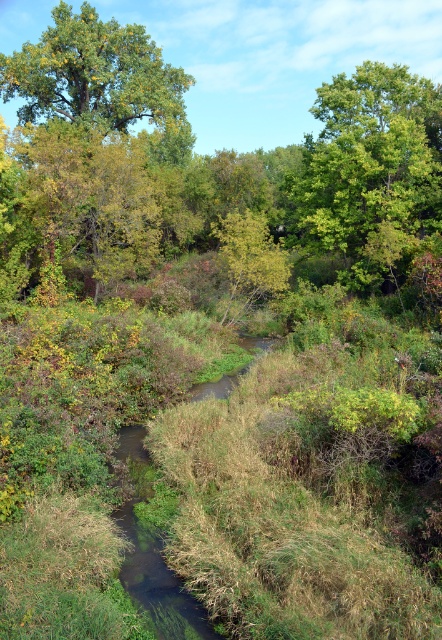
You are planning to plant a new tree in this area and need to ensure it will have enough space between the existing trees. The new tree requires a minimum of 5 meters of space between itself and any other tree. Given the current spacing between the green leafy tree at upper right and the green leafy tree at center, can you plant the new tree between them without violating the spacing requirement?

The distance between the green leafy tree at upper right and the green leafy tree at center is 4.51 meters, which is less than the required 5 meters. Therefore, planting a new tree between them would not meet the spacing requirement since the existing trees are already too close together.

You are standing at a point in the serene natural scene with a stream. You want to know how far you are from the point marked as point (60, 113). Can you determine the distance?

The distance between you and the point (60, 113) is 150.70 feet.